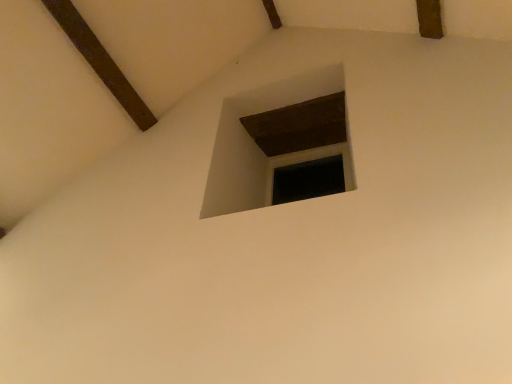
What is the approximate width of dark wood window at upper center?

It is 22.92 inches.

The height and width of the screenshot is (384, 512). What are the coordinates of `dark wood window at upper center` in the screenshot? It's located at (261, 146).

The image size is (512, 384). Describe the element at coordinates (261, 146) in the screenshot. I see `dark wood window at upper center` at that location.

Where is `dark wood window at upper center`? The width and height of the screenshot is (512, 384). dark wood window at upper center is located at coordinates (261, 146).